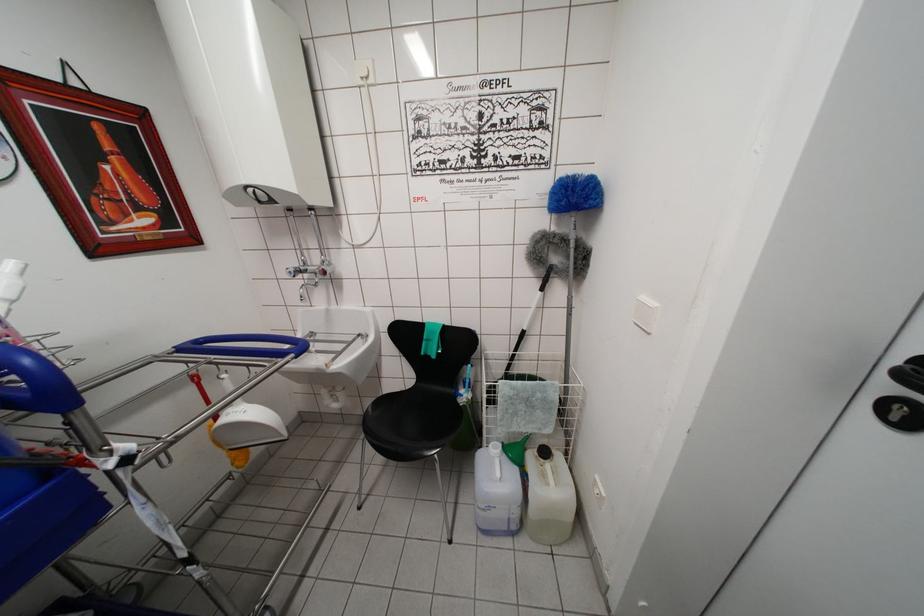
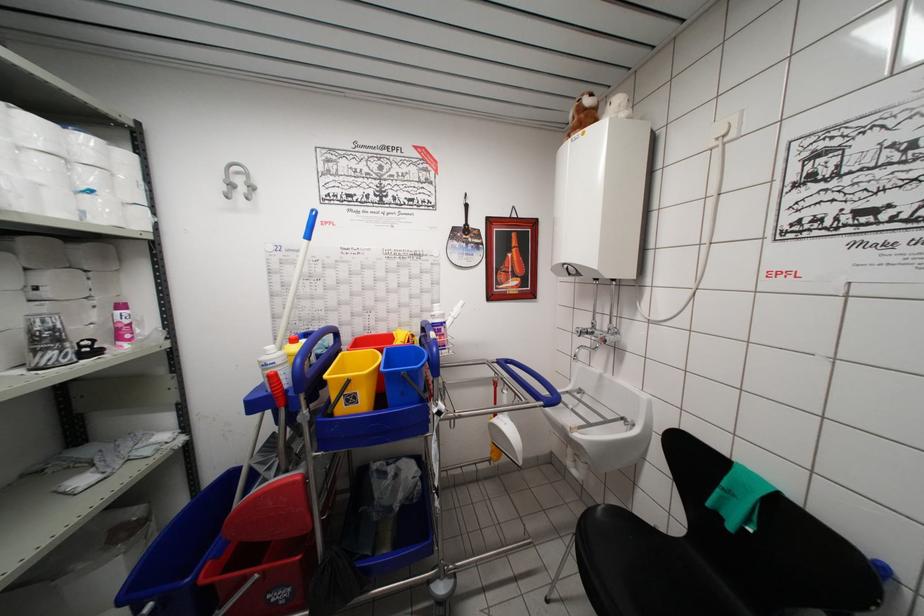
Question: The first image is from the beginning of the video and the second image is from the end. How did the camera likely rotate when shooting the video?

Choices:
 (A) Left
 (B) Right
 (C) Up
 (D) Down

Answer: (A)